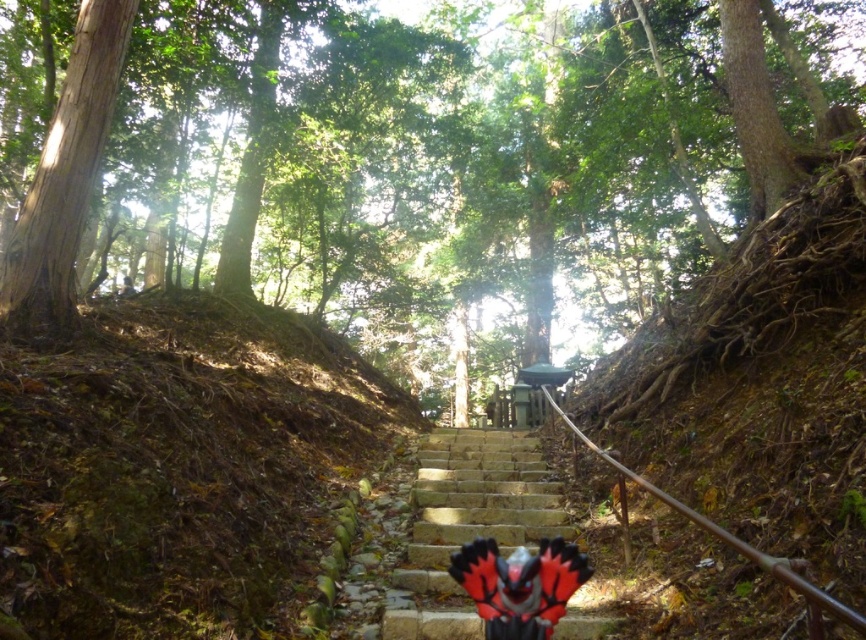
Question: Which point is closer to the camera?

Choices:
 (A) (563, 628)
 (B) (199, 330)
 (C) (55, 29)

Answer: (A)

Question: Can you confirm if brown rough tree at center is positioned to the right of brown/dry soil at left?

Choices:
 (A) no
 (B) yes

Answer: (B)

Question: Which object appears farthest from the camera in this image?

Choices:
 (A) brown rough tree at center
 (B) stone stairs at center

Answer: (A)

Question: Can you confirm if brown rough tree at center is positioned below brown/dry soil at left?

Choices:
 (A) no
 (B) yes

Answer: (A)

Question: Is brown rough tree at center to the left of brown/dry soil at left from the viewer's perspective?

Choices:
 (A) no
 (B) yes

Answer: (A)

Question: Among these points, which one is nearest to the camera?

Choices:
 (A) (231, 346)
 (B) (509, 484)

Answer: (B)